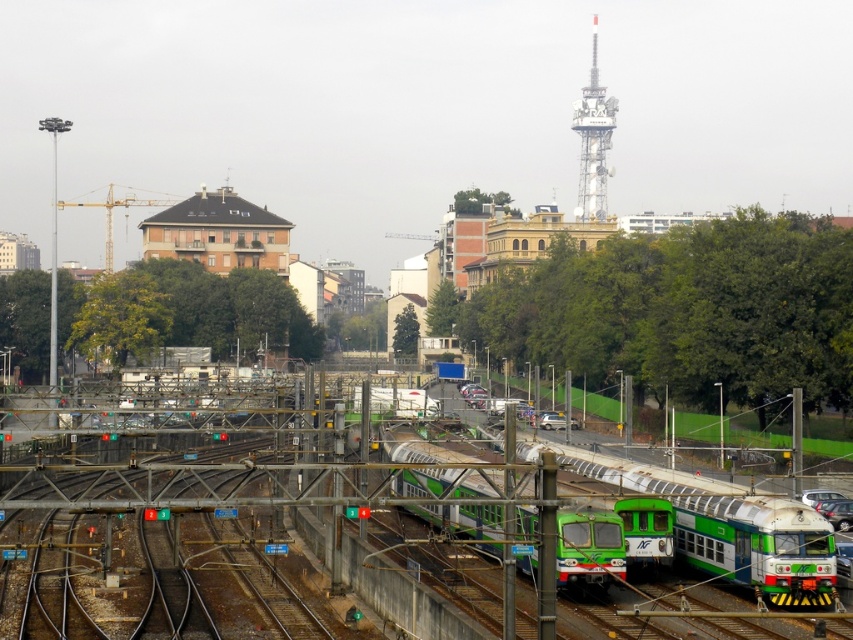
Who is shorter, green matte train at center or green metallic train at center?

With less height is green matte train at center.

Which is below, green matte train at center or green metallic train at center?

green metallic train at center

Between point (770, 515) and point (474, 492), which one is positioned in front?

Point (770, 515) is in front.

Locate an element on the screen. Image resolution: width=853 pixels, height=640 pixels. green matte train at center is located at coordinates (724, 525).

The height and width of the screenshot is (640, 853). Identify the location of green metallic train at center. (589, 547).

From the picture: Is green metallic train at center to the right of metallic gray tower at upper center from the viewer's perspective?

Incorrect, green metallic train at center is not on the right side of metallic gray tower at upper center.

Locate an element on the screen. green metallic train at center is located at coordinates (589, 547).

Who is positioned more to the right, green matte train at center or metallic gray tower at upper center?

Positioned to the right is metallic gray tower at upper center.

Which is behind, point (606, 474) or point (606, 106)?

The point (606, 106) is behind.

The width and height of the screenshot is (853, 640). I want to click on green matte train at center, so click(x=724, y=525).